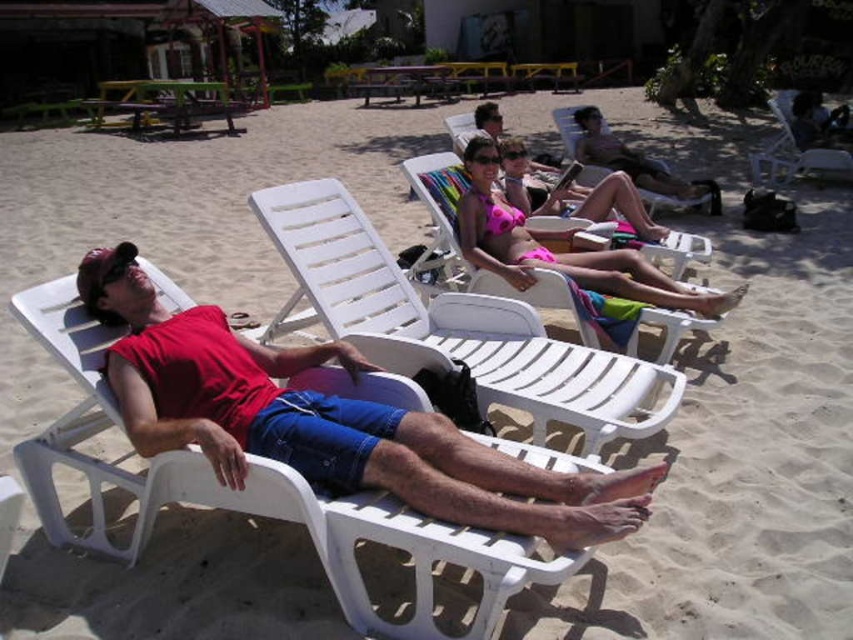
Question: Which is nearer to the white plastic beach chair at center?

Choices:
 (A) pink fabric beach chair at center
 (B) red matte/vinyl man at center
 (C) pink fabric towel at center

Answer: (B)

Question: Is pink fabric beach chair at center bigger than white plastic beach chair at upper right?

Choices:
 (A) no
 (B) yes

Answer: (B)

Question: Which point is closer to the camera?

Choices:
 (A) (846, 173)
 (B) (556, 260)
 (C) (233, 362)

Answer: (C)

Question: Does red matte/vinyl man at center come behind white plastic beach chair at center?

Choices:
 (A) no
 (B) yes

Answer: (A)

Question: Can you confirm if white plastic beach chair at center is positioned to the right of pink fabric towel at center?

Choices:
 (A) no
 (B) yes

Answer: (A)

Question: Estimate the real-world distances between objects in this image. Which object is farther from the pink fabric beach chair at center?

Choices:
 (A) pink fabric bikini at center
 (B) red matte/vinyl man at center
 (C) white plastic beach chair at upper right

Answer: (B)